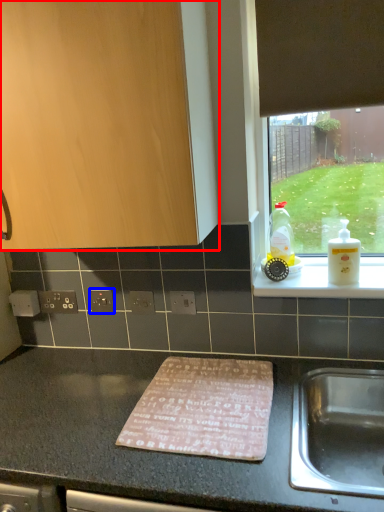
Question: Which object is closer to the camera taking this photo, cabinetry (highlighted by a red box) or electric outlet (highlighted by a blue box)?

Choices:
 (A) cabinetry
 (B) electric outlet

Answer: (A)